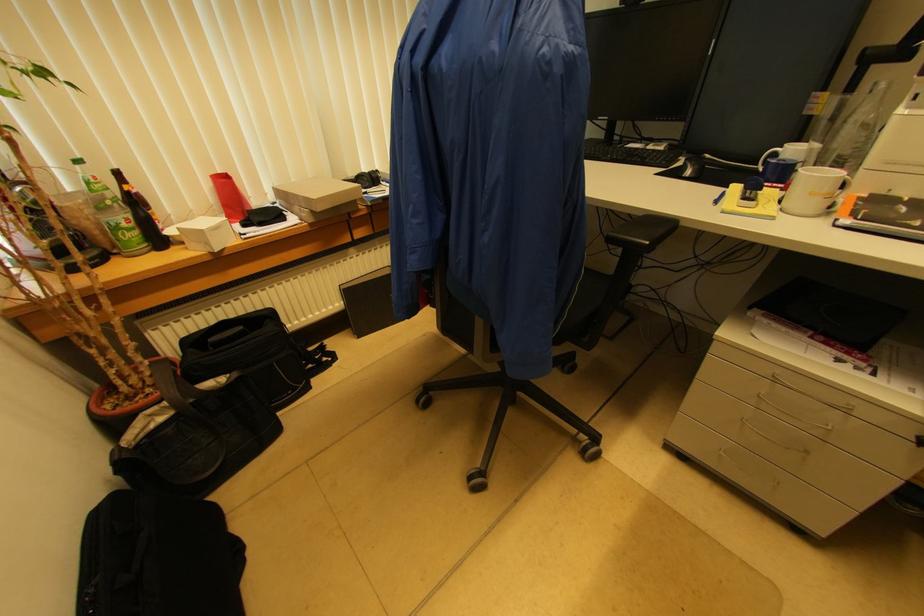
Find where to lift the clear drinking glass. Please return your answer as a coordinate pair (x, y).

(846, 128)